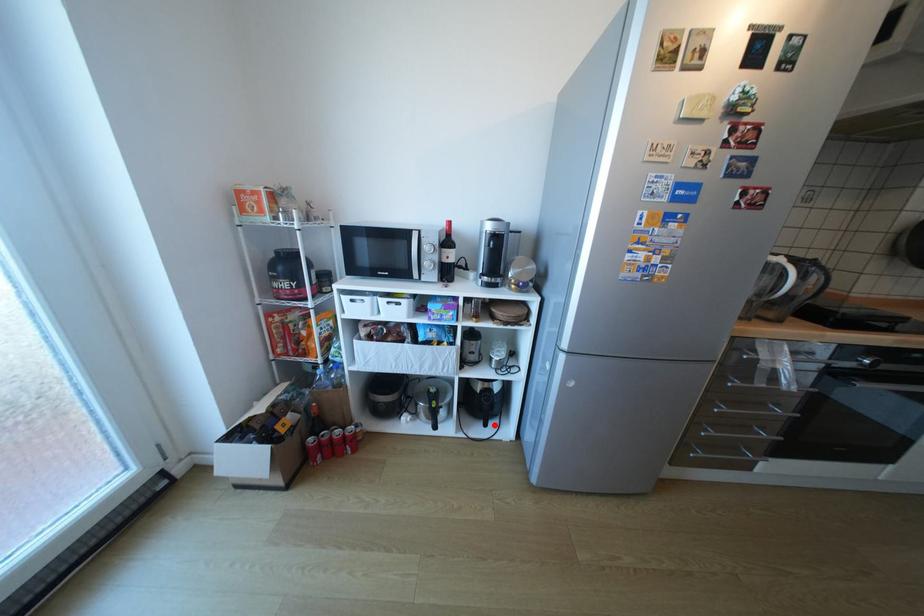
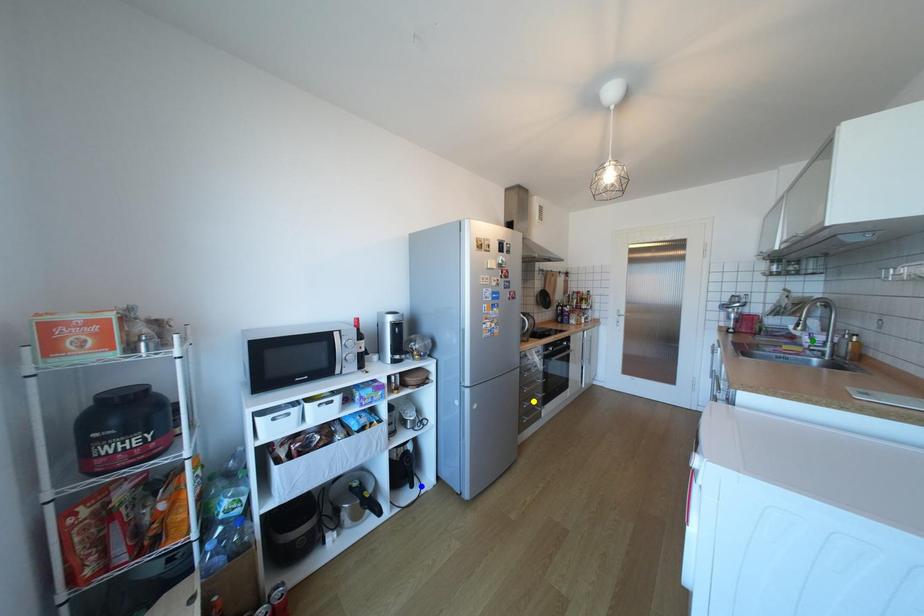
Question: I am providing you with two images of the same scene from different viewpoints. A red point is marked on the first image. You are given multiple points on the second image. Which point in image 2 represents the same 3d spot as the red point in image 1?

Choices:
 (A) blue point
 (B) yellow point
 (C) green point

Answer: (A)